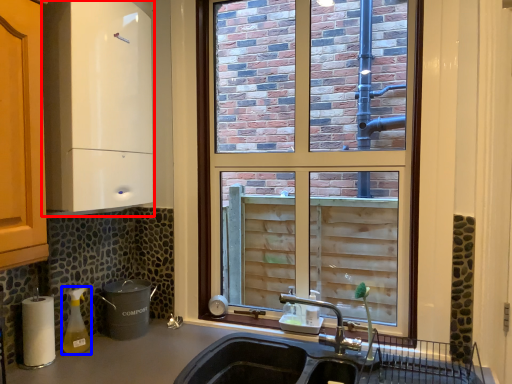
Question: Which of the following is the closest to the observer, appliance (highlighted by a red box) or bottle (highlighted by a blue box)?

Choices:
 (A) appliance
 (B) bottle

Answer: (A)